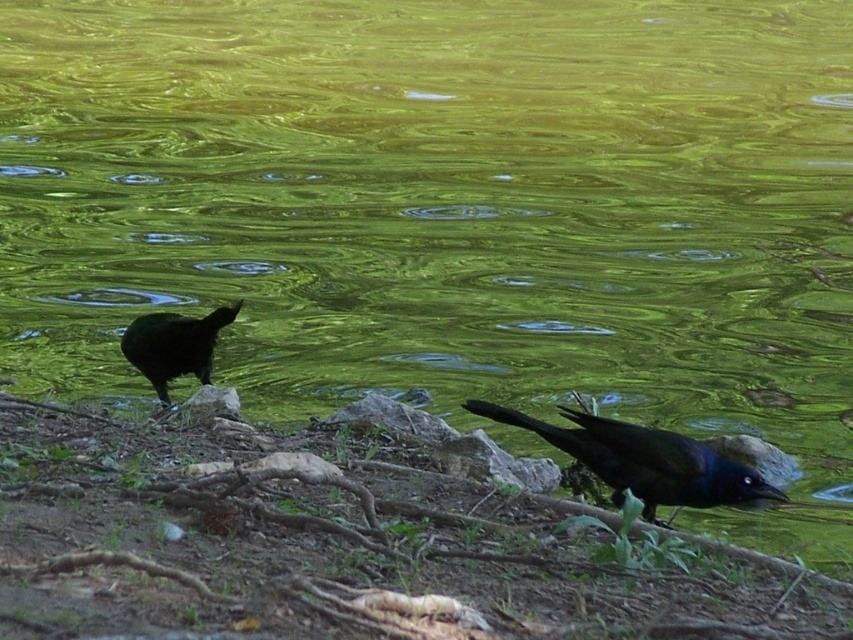
The height and width of the screenshot is (640, 853). In order to click on shiny black bird at lower right in this screenshot , I will do `click(643, 460)`.

Between point (596, 436) and point (209, 385), which one is positioned in front?

Positioned in front is point (596, 436).

At what (x,y) coordinates should I click in order to perform the action: click on shiny black bird at lower right. Please return your answer as a coordinate pair (x, y). The width and height of the screenshot is (853, 640). Looking at the image, I should click on (643, 460).

Can you confirm if shiny black bird at lower right is positioned to the right of shiny black bird at lower left?

Yes, shiny black bird at lower right is to the right of shiny black bird at lower left.

Between shiny black bird at lower right and shiny black bird at lower left, which one has less height?

shiny black bird at lower right is shorter.

Which is in front, point (660, 445) or point (170, 337)?

Point (660, 445)

Find the location of `shiny black bird at lower right`. shiny black bird at lower right is located at coordinates (643, 460).

Which is more to the left, shiny black bird at lower right or smooth gray rock at center?

From the viewer's perspective, smooth gray rock at center appears more on the left side.

The image size is (853, 640). What do you see at coordinates (643, 460) in the screenshot?
I see `shiny black bird at lower right` at bounding box center [643, 460].

Image resolution: width=853 pixels, height=640 pixels. In order to click on shiny black bird at lower right in this screenshot , I will do `click(643, 460)`.

The image size is (853, 640). In order to click on shiny black bird at lower right in this screenshot , I will do `click(643, 460)`.